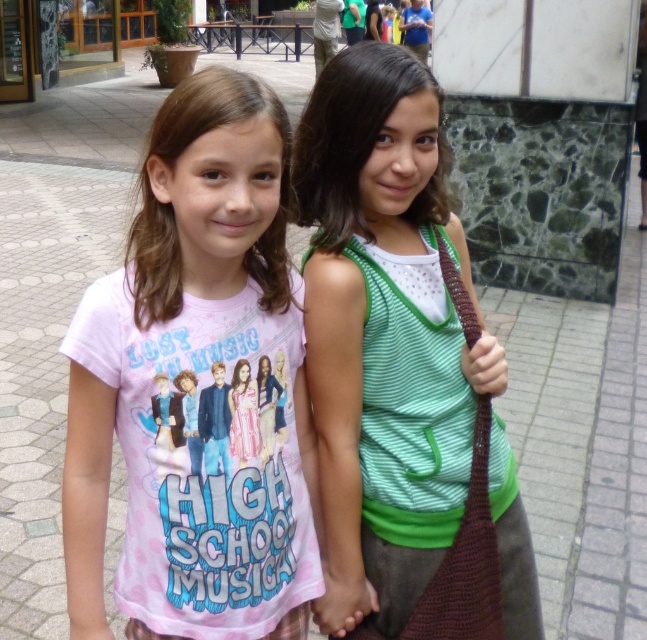
Question: Does pink cotton t-shirt at center appear over green knitted tank top at center?

Choices:
 (A) no
 (B) yes

Answer: (A)

Question: Which point appears farthest from the camera in this image?

Choices:
 (A) (457, 576)
 (B) (160, 136)

Answer: (A)

Question: Can you confirm if pink cotton t-shirt at center is smaller than green knitted tank top at center?

Choices:
 (A) yes
 (B) no

Answer: (A)

Question: Which object appears closest to the camera in this image?

Choices:
 (A) green knitted tank top at center
 (B) pink cotton t-shirt at center

Answer: (B)

Question: In this image, where is pink cotton t-shirt at center located relative to green knitted tank top at center?

Choices:
 (A) above
 (B) below

Answer: (B)